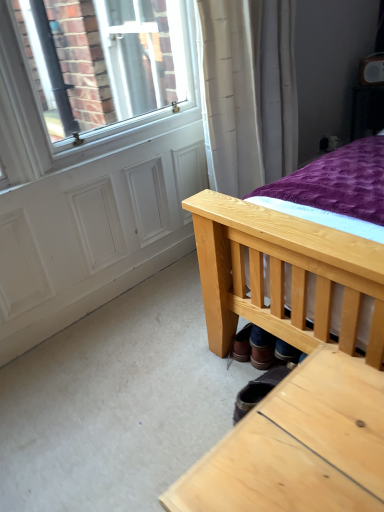
Question: Is brown leather shoe at lower center bigger than leather boot at lower center?

Choices:
 (A) yes
 (B) no

Answer: (B)

Question: Is brown leather shoe at lower center facing towards leather boot at lower center?

Choices:
 (A) no
 (B) yes

Answer: (A)

Question: Can you confirm if brown leather shoe at lower center is shorter than leather boot at lower center?

Choices:
 (A) yes
 (B) no

Answer: (B)

Question: Considering the relative sizes of brown leather shoe at lower center and leather boot at lower center in the image provided, is brown leather shoe at lower center thinner than leather boot at lower center?

Choices:
 (A) yes
 (B) no

Answer: (A)

Question: Is brown leather shoe at lower center at the right side of leather boot at lower center?

Choices:
 (A) yes
 (B) no

Answer: (A)

Question: Is brown leather shoe at lower center situated inside leather boot at lower center or outside?

Choices:
 (A) outside
 (B) inside

Answer: (A)

Question: Based on their sizes in the image, would you say brown leather shoe at lower center is bigger or smaller than leather boot at lower center?

Choices:
 (A) big
 (B) small

Answer: (B)

Question: Is brown leather shoe at lower center to the left or to the right of leather boot at lower center in the image?

Choices:
 (A) right
 (B) left

Answer: (A)

Question: Is point (251, 357) positioned closer to the camera than point (240, 406)?

Choices:
 (A) closer
 (B) farther

Answer: (B)

Question: Is brown leather shoe at lower center bigger or smaller than white matte screen door at lower left?

Choices:
 (A) big
 (B) small

Answer: (B)

Question: Would you say brown leather shoe at lower center is to the left or to the right of white matte screen door at lower left in the picture?

Choices:
 (A) right
 (B) left

Answer: (A)

Question: Considering the positions of point (299, 354) and point (51, 296), is point (299, 354) closer or farther from the camera than point (51, 296)?

Choices:
 (A) closer
 (B) farther

Answer: (A)

Question: In terms of width, does brown leather shoe at lower center look wider or thinner when compared to white matte screen door at lower left?

Choices:
 (A) wide
 (B) thin

Answer: (A)

Question: From a real-world perspective, is leather boot at lower center physically located above or below brown leather shoe at lower center?

Choices:
 (A) above
 (B) below

Answer: (B)

Question: In terms of width, does leather boot at lower center look wider or thinner when compared to brown leather shoe at lower center?

Choices:
 (A) wide
 (B) thin

Answer: (A)